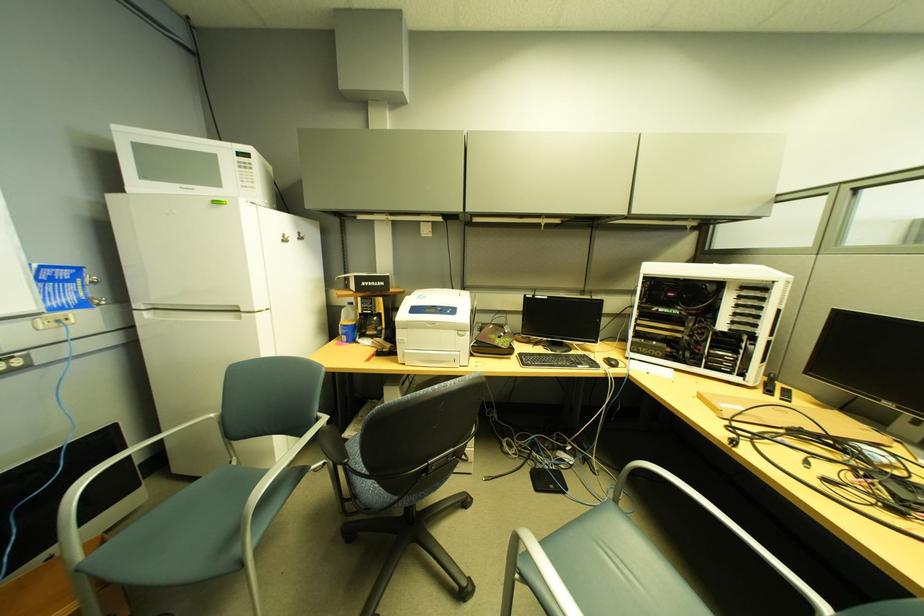
This screenshot has width=924, height=616. Describe the element at coordinates (244, 161) in the screenshot. I see `a microwave button` at that location.